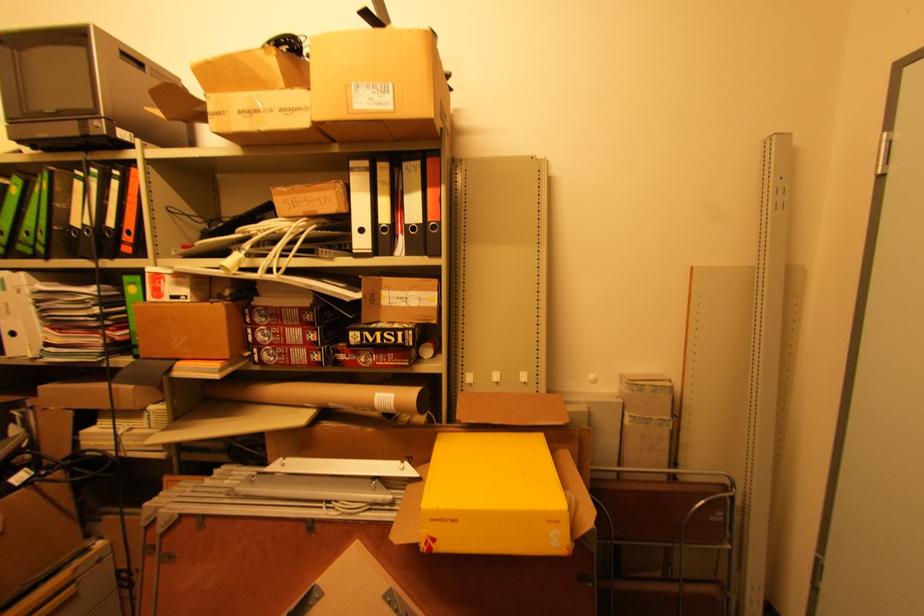
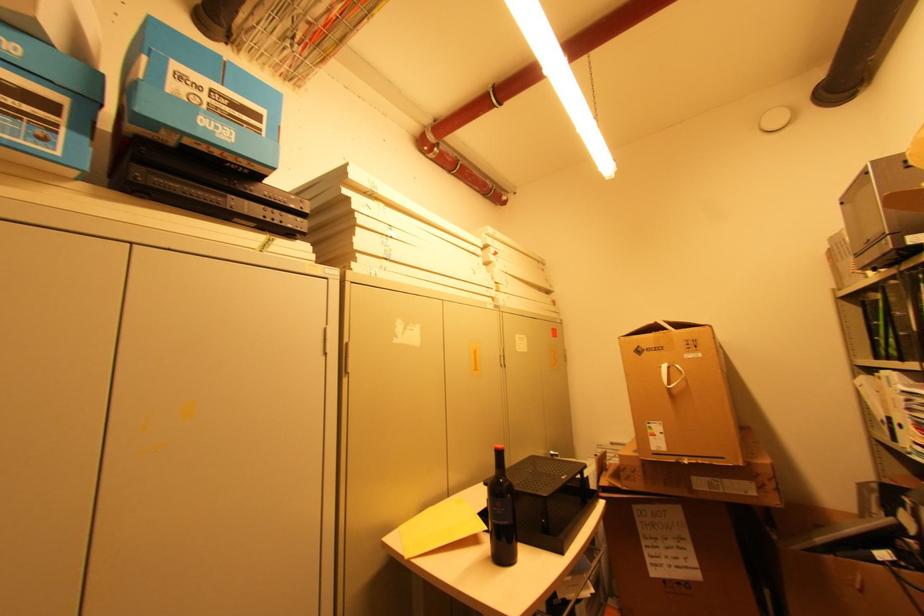
Where in the second image is the point corresponding to the point at 61,200 from the first image?

(896, 310)